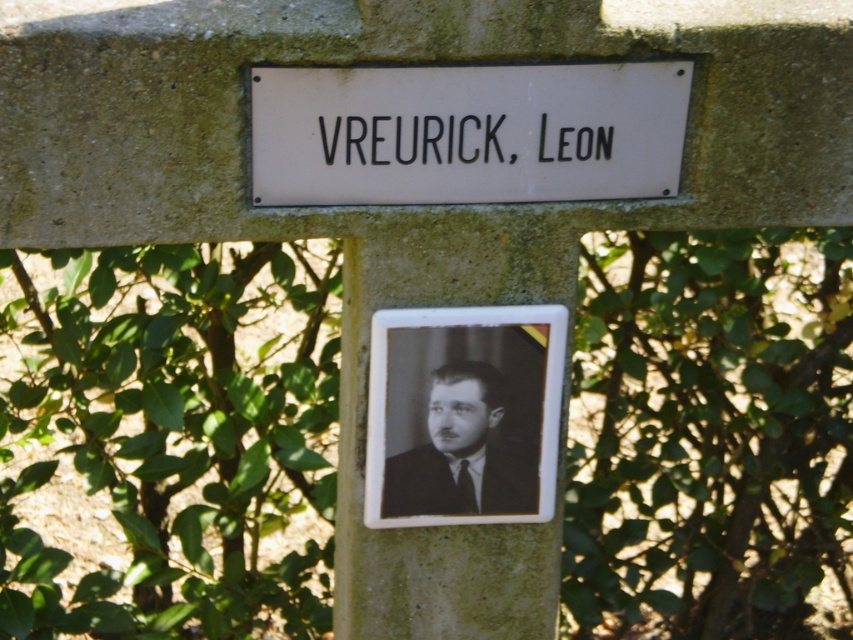
Question: Considering the real-world distances, which object is closest to the black text at center?

Choices:
 (A) white matte sign at center
 (B) black matte portrait at center

Answer: (A)

Question: Which is farther from the black text at center?

Choices:
 (A) white matte sign at center
 (B) black matte portrait at center

Answer: (B)

Question: Is black matte portrait at center to the left of black text at center from the viewer's perspective?

Choices:
 (A) no
 (B) yes

Answer: (B)

Question: Which point is closer to the camera?

Choices:
 (A) (462, 161)
 (B) (494, 387)

Answer: (A)

Question: Is white matte sign at center closer to the viewer compared to black matte portrait at center?

Choices:
 (A) yes
 (B) no

Answer: (A)

Question: Does white matte sign at center lie in front of black matte portrait at center?

Choices:
 (A) no
 (B) yes

Answer: (B)